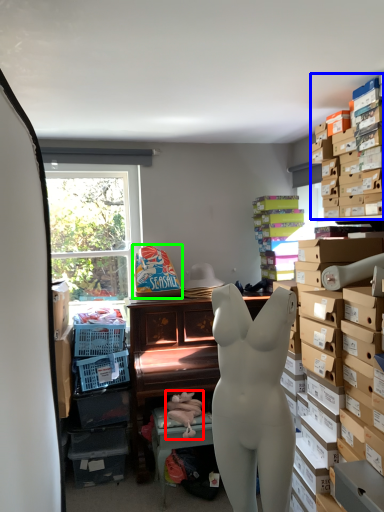
Question: Based on their relative distances, which object is farther from toy (highlighted by a red box)? Choose from shelf (highlighted by a blue box) and toy (highlighted by a green box).

Choices:
 (A) shelf
 (B) toy

Answer: (A)